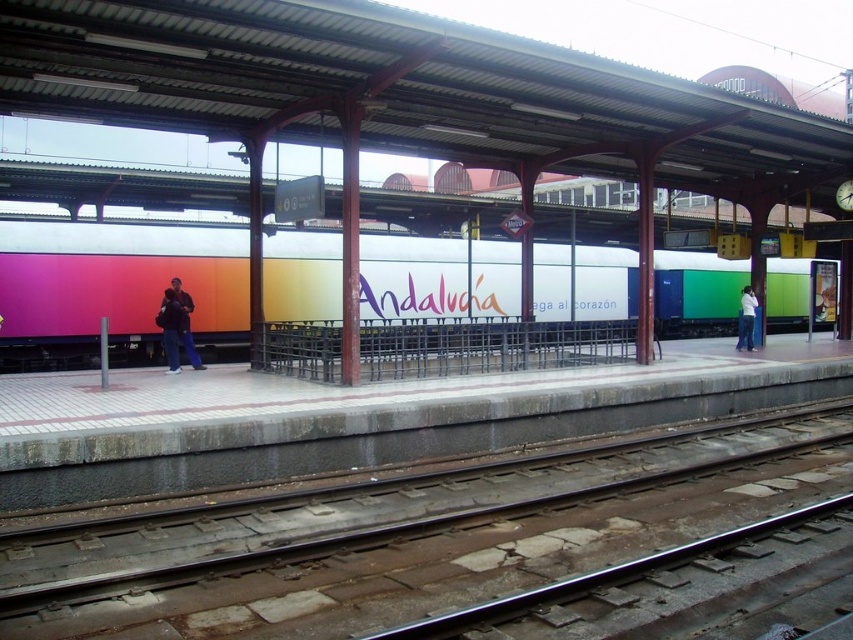
You are a maintenance worker who needs to place a large equipment box on the platform. The box requires a flat, unobstructed area. Which area would be more suitable between the metal at center and the concrete platform at center?

The concrete platform at center is more suitable because it occupies more space than the metal at center, providing a larger flat area for placing the equipment box.

You are standing on the platform and want to take a photo of the metal at center. You have a camera that can focus up to 16 feet. Can you take the photo without moving closer?

The metal at center and camera are 15.98 feet apart. Since the camera can focus up to 16 feet, you can take the photo without moving closer.